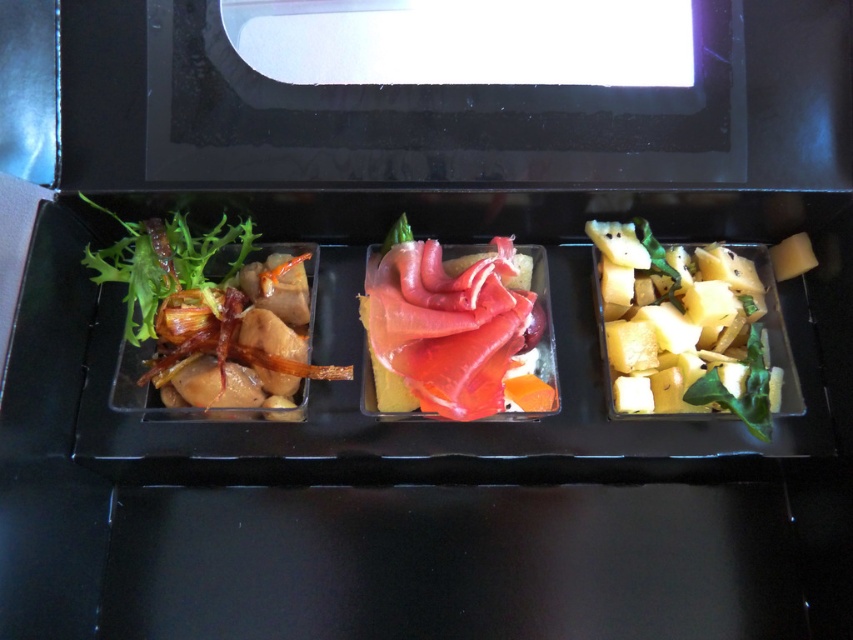
Question: Does yellow crumbly cheese at right appear on the left side of pink raw fish at center?

Choices:
 (A) yes
 (B) no

Answer: (B)

Question: Which point appears farthest from the camera in this image?

Choices:
 (A) (265, 397)
 (B) (717, 378)

Answer: (A)

Question: Is yellow crumbly cheese at right to the right of pink raw fish at center from the viewer's perspective?

Choices:
 (A) no
 (B) yes

Answer: (B)

Question: Does glossy brown salad at left appear under yellow crumbly cheese at right?

Choices:
 (A) yes
 (B) no

Answer: (B)

Question: Among these points, which one is farthest from the camera?

Choices:
 (A) (183, 243)
 (B) (426, 253)
 (C) (693, 364)

Answer: (B)

Question: Which point is closer to the camera?

Choices:
 (A) (409, 385)
 (B) (679, 244)

Answer: (A)